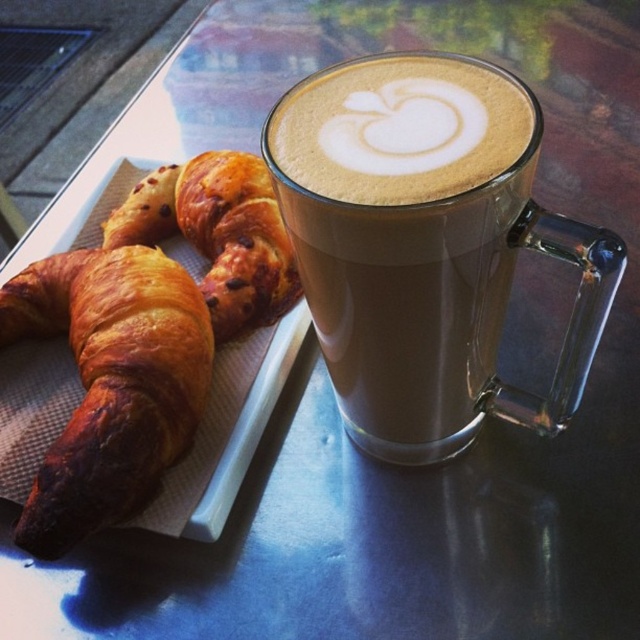
Is brown frothy latte at center behind golden-brown flaky croissant at left?

No, brown frothy latte at center is in front of golden-brown flaky croissant at left.

Which of these two, brown frothy latte at center or golden-brown flaky croissant at left, stands shorter?

golden-brown flaky croissant at left

The width and height of the screenshot is (640, 640). What do you see at coordinates (426, 244) in the screenshot?
I see `brown frothy latte at center` at bounding box center [426, 244].

The image size is (640, 640). I want to click on brown frothy latte at center, so click(426, 244).

Is point (88, 317) positioned in front of point (353, 156)?

No, it is behind (353, 156).

Is golden-brown flaky croissant at left positioned in front of brown frothy latte art at upper center?

No, golden-brown flaky croissant at left is further to the viewer.

Identify the location of golden-brown flaky croissant at left. This screenshot has height=640, width=640. (112, 384).

Does brown frothy latte at center appear on the right side of golden brown flaky croissant at left?

Indeed, brown frothy latte at center is positioned on the right side of golden brown flaky croissant at left.

Is point (342, 147) closer to camera compared to point (250, 170)?

Yes, point (342, 147) is in front of point (250, 170).

Is point (301, 209) farther from viewer compared to point (234, 301)?

No, it is in front of (234, 301).

What are the coordinates of `brown frothy latte at center` in the screenshot? It's located at (426, 244).